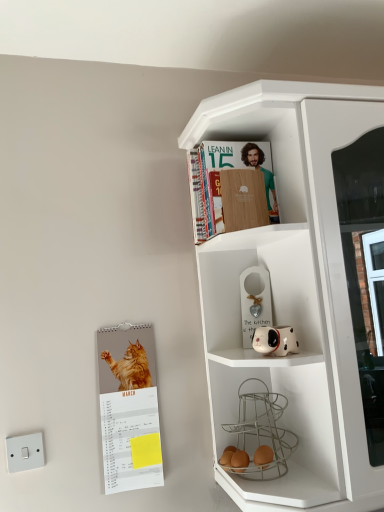
Question: From the image's perspective, is orange fur cat calendar at left on white plastic switch at lower left?

Choices:
 (A) no
 (B) yes

Answer: (B)

Question: Is orange fur cat calendar at left not close to white plastic switch at lower left?

Choices:
 (A) no
 (B) yes

Answer: (A)

Question: Is orange fur cat calendar at left at the left side of white plastic switch at lower left?

Choices:
 (A) no
 (B) yes

Answer: (A)

Question: Is white plastic switch at lower left at the back of orange fur cat calendar at left?

Choices:
 (A) no
 (B) yes

Answer: (A)

Question: Can you confirm if orange fur cat calendar at left is positioned to the right of white plastic switch at lower left?

Choices:
 (A) yes
 (B) no

Answer: (A)

Question: In terms of height, does wooden cover book at upper center look taller or shorter compared to orange fur cat calendar at left?

Choices:
 (A) tall
 (B) short

Answer: (B)

Question: From a real-world perspective, relative to orange fur cat calendar at left, is wooden cover book at upper center vertically above or below?

Choices:
 (A) below
 (B) above

Answer: (B)

Question: Which is correct: wooden cover book at upper center is inside orange fur cat calendar at left, or outside of it?

Choices:
 (A) inside
 (B) outside

Answer: (B)

Question: From the image's perspective, is wooden cover book at upper center above or below orange fur cat calendar at left?

Choices:
 (A) below
 (B) above

Answer: (B)

Question: Would you say white matte cupboard at upper right is to the left or to the right of white plastic switch at lower left in the picture?

Choices:
 (A) right
 (B) left

Answer: (A)

Question: In terms of height, does white matte cupboard at upper right look taller or shorter compared to white plastic switch at lower left?

Choices:
 (A) short
 (B) tall

Answer: (B)

Question: Considering the positions of point pyautogui.click(x=352, y=424) and point pyautogui.click(x=16, y=449), is point pyautogui.click(x=352, y=424) closer or farther from the camera than point pyautogui.click(x=16, y=449)?

Choices:
 (A) farther
 (B) closer

Answer: (B)

Question: Considering the positions of white matte cupboard at upper right and white plastic switch at lower left in the image, is white matte cupboard at upper right wider or thinner than white plastic switch at lower left?

Choices:
 (A) thin
 (B) wide

Answer: (B)

Question: Is point (13, 442) closer or farther from the camera than point (291, 352)?

Choices:
 (A) closer
 (B) farther

Answer: (B)

Question: Based on their sizes in the image, would you say white plastic switch at lower left is bigger or smaller than white glossy dog-shaped planter at middle right?

Choices:
 (A) big
 (B) small

Answer: (B)